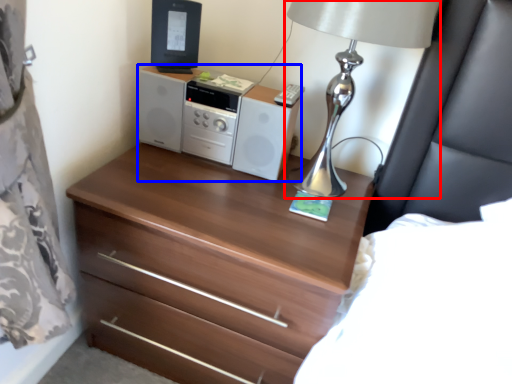
Question: Which of the following is the farthest to the observer, table lamp (highlighted by a red box) or stereo (highlighted by a blue box)?

Choices:
 (A) table lamp
 (B) stereo

Answer: (B)